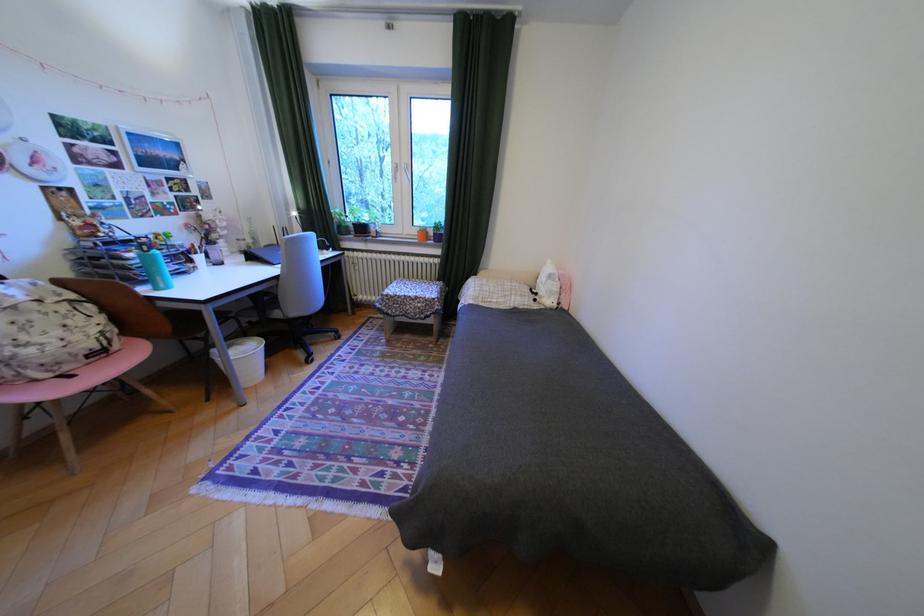
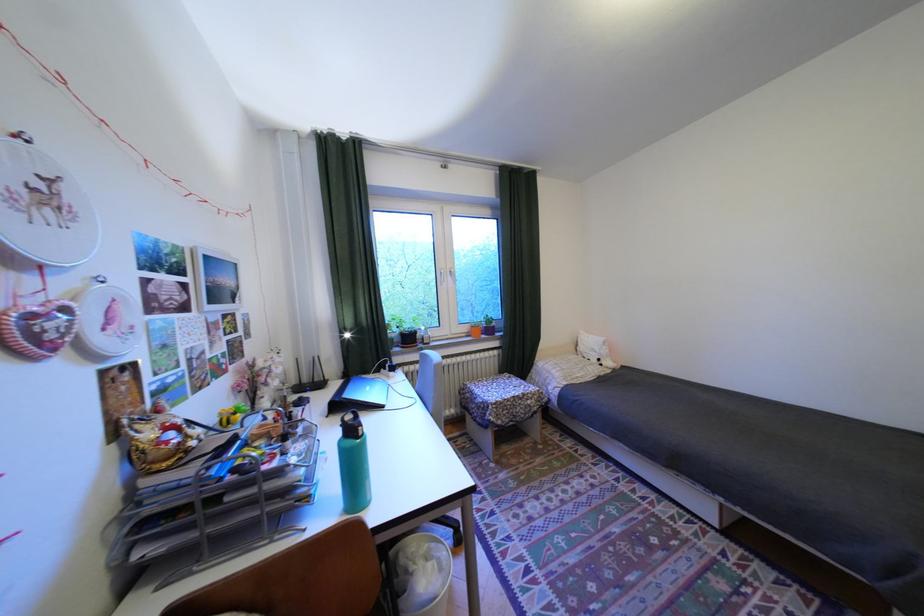
The point at [548,294] is marked in the first image. Where is the corresponding point in the second image?

(611, 360)